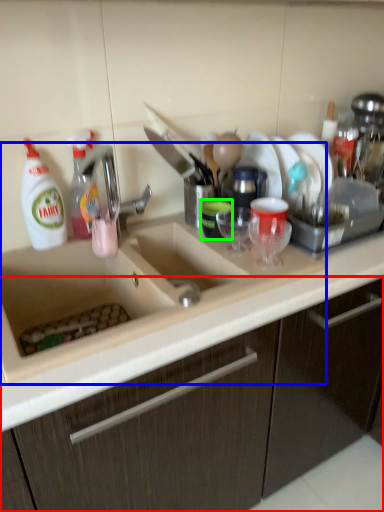
Question: Based on their relative distances, which object is farther from cabinetry (highlighted by a red box)? Choose from sink (highlighted by a blue box) and tableware (highlighted by a green box).

Choices:
 (A) sink
 (B) tableware

Answer: (B)